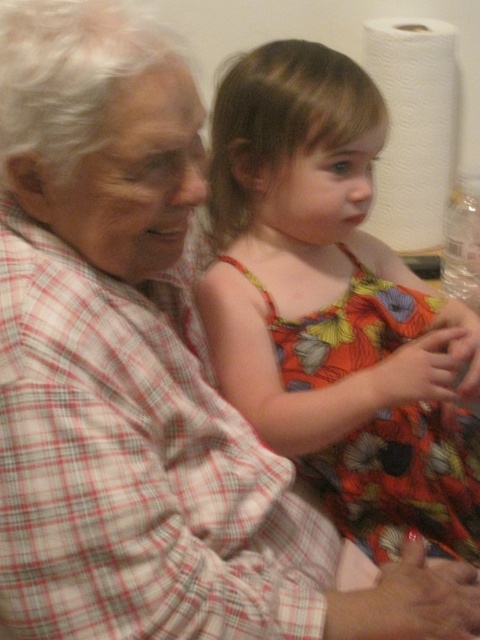
Is floral fabric dress at center to the right of white paper towel at upper right from the viewer's perspective?

No, floral fabric dress at center is not to the right of white paper towel at upper right.

The width and height of the screenshot is (480, 640). What do you see at coordinates (335, 307) in the screenshot?
I see `floral fabric dress at center` at bounding box center [335, 307].

Locate an element on the screen. floral fabric dress at center is located at coordinates (x=335, y=307).